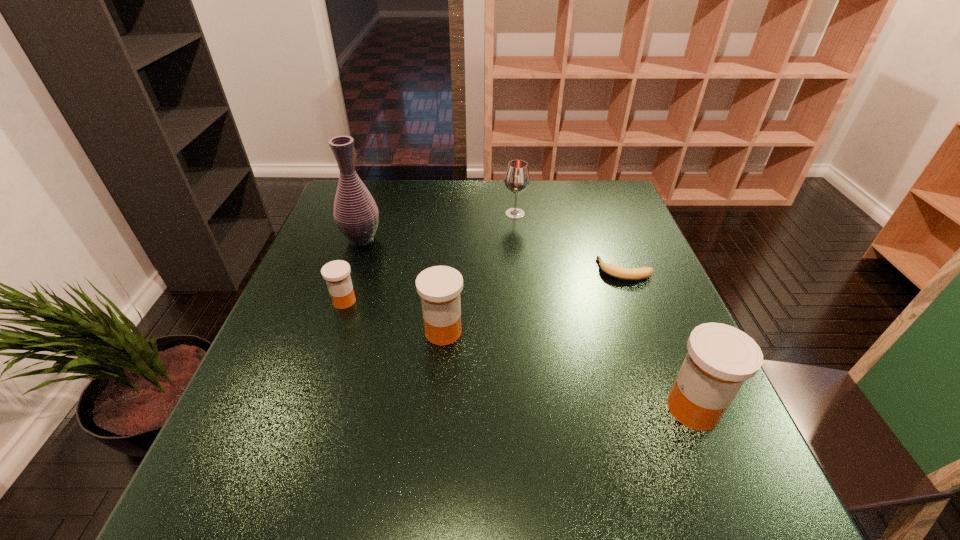
Please point a location where one more medicine can be added evenly. Please provide its 2D coordinates. Your answer should be formatted as a tuple, i.e. [(x, y)], where the tuple contains the x and y coordinates of a point satisfying the conditions above.

[(558, 367)]